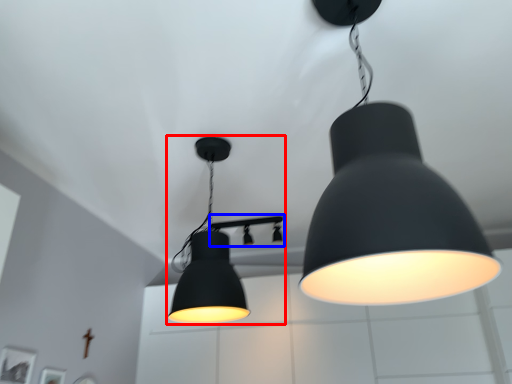
Question: Which object appears farthest to the camera in this image, lamp (highlighted by a red box) or lamp (highlighted by a blue box)?

Choices:
 (A) lamp
 (B) lamp

Answer: (B)